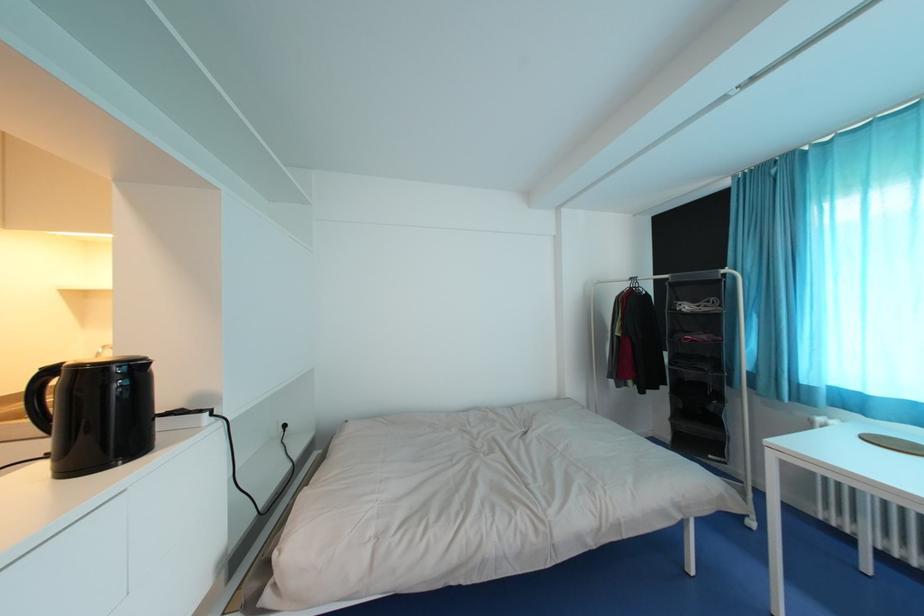
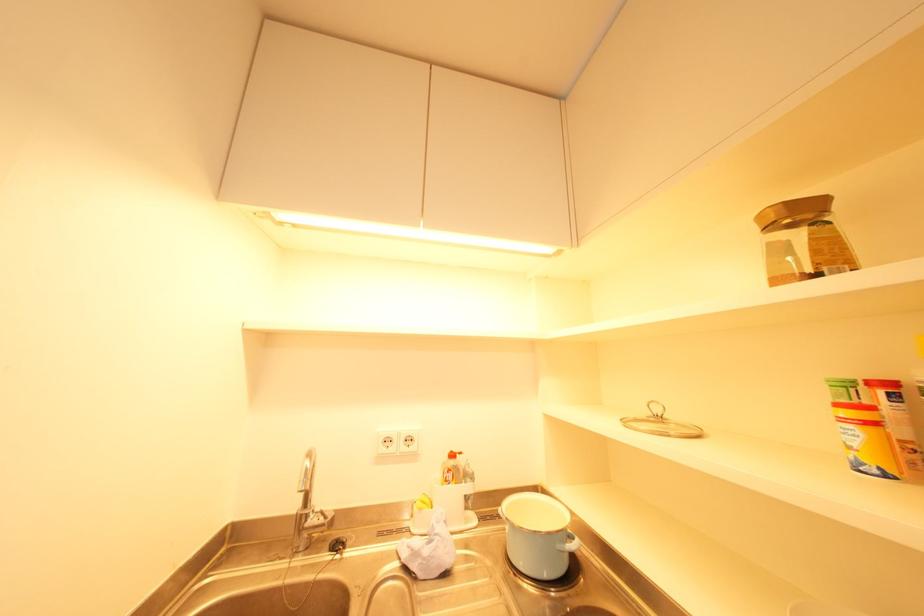
In a continuous first-person perspective shot, in which direction is the camera moving?

The movement direction of the cameraman is left, forward.